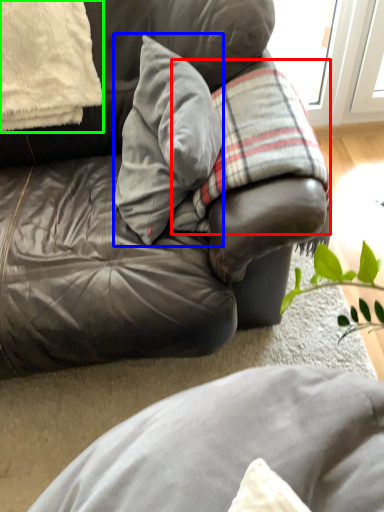
Question: Estimate the real-world distances between objects in this image. Which object is closer to plaid (highlighted by a red box), pillow (highlighted by a blue box) or pillow (highlighted by a green box)?

Choices:
 (A) pillow
 (B) pillow

Answer: (A)